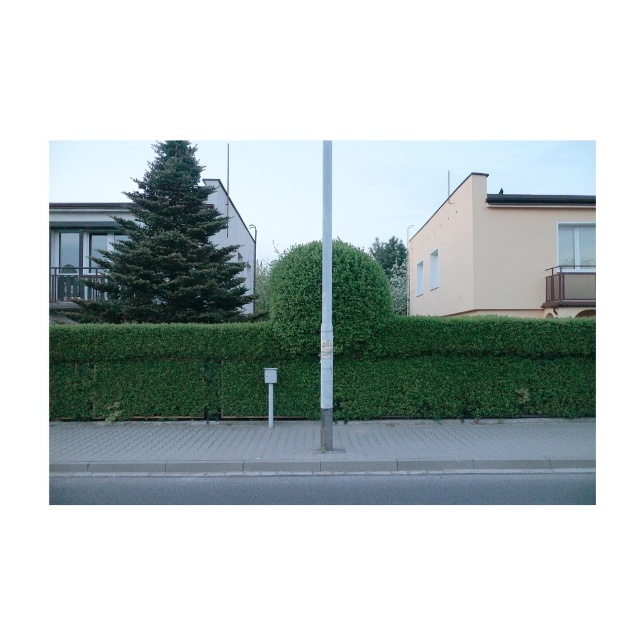
Is green leafy bush at center bigger than smooth white pole at center?

Correct, green leafy bush at center is larger in size than smooth white pole at center.

Who is lower down, green leafy bush at center or smooth white pole at center?

green leafy bush at center

At what (x,y) coordinates should I click in order to perform the action: click on green leafy bush at center. Please return your answer as a coordinate pair (x, y). The image size is (636, 640). Looking at the image, I should click on (356, 298).

Which is in front, point (169, 337) or point (375, 497)?

Point (375, 497) is in front.

Which of these two, green leafy hedge at center or gray asphalt at lower center, stands taller?

With more height is green leafy hedge at center.

In order to click on green leafy hedge at center in this screenshot , I will do `click(469, 369)`.

Where is `green leafy hedge at center`? green leafy hedge at center is located at coordinates (469, 369).

Is point (106, 476) behind point (266, 412)?

No, (106, 476) is closer to viewer.

Based on the photo, is the position of gray asphalt at lower center less distant than that of metallic gray street sign at center?

Yes, gray asphalt at lower center is in front of metallic gray street sign at center.

Who is more forward, (86, 477) or (270, 390)?

Point (86, 477)

The image size is (636, 640). Find the location of `gray asphalt at lower center`. gray asphalt at lower center is located at coordinates tap(328, 488).